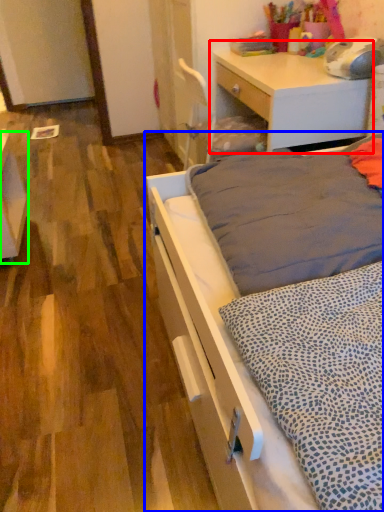
Question: Estimate the real-world distances between objects in this image. Which object is closer to desk (highlighted by a red box), bed (highlighted by a blue box) or vanity (highlighted by a green box)?

Choices:
 (A) bed
 (B) vanity

Answer: (A)